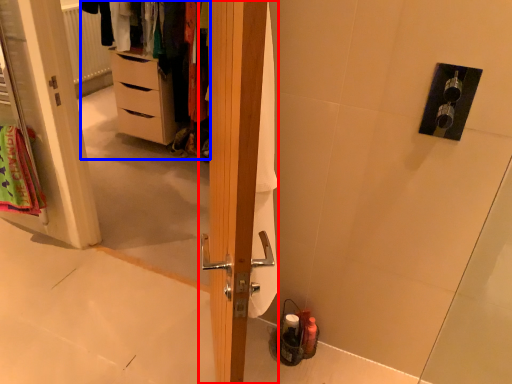
Question: Which object is further to the camera taking this photo, door (highlighted by a red box) or dresser (highlighted by a blue box)?

Choices:
 (A) door
 (B) dresser

Answer: (B)